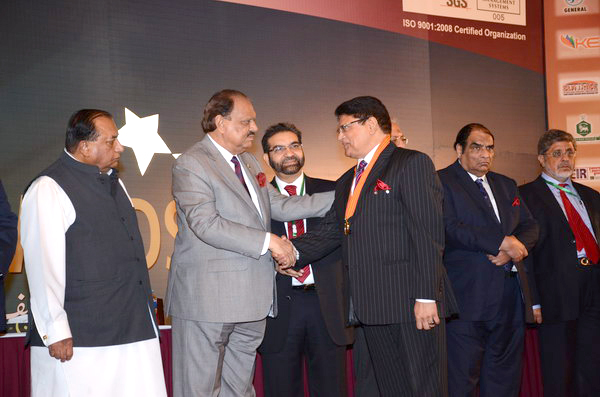
Find the location of a particular element. The image size is (600, 397). wall is located at coordinates (322, 93).